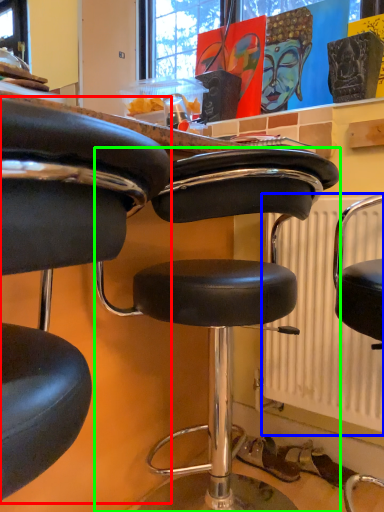
Question: Based on their relative distances, which object is farther from chair (highlighted by a red box)? Choose from radiator (highlighted by a blue box) and chair (highlighted by a green box).

Choices:
 (A) radiator
 (B) chair

Answer: (A)